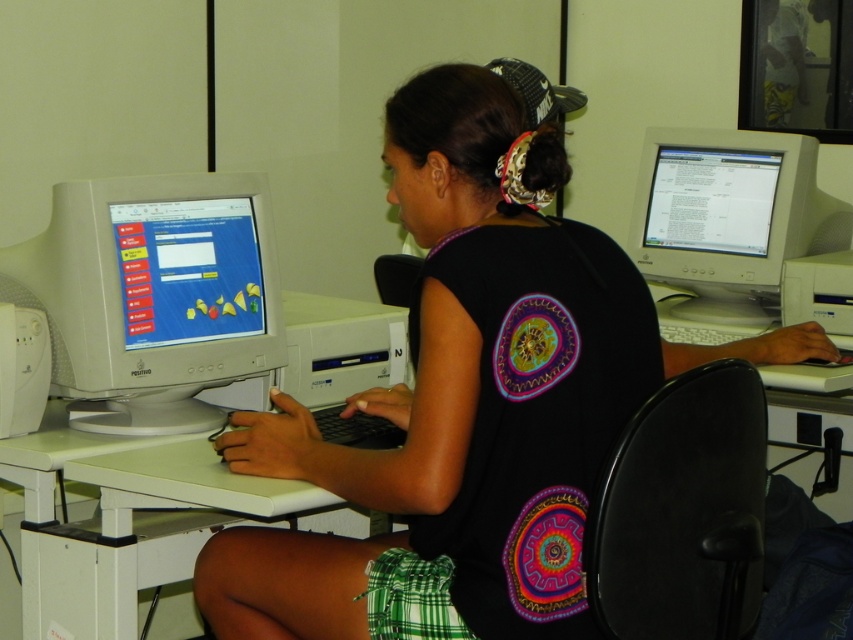
Find the location of a particular element. This screenshot has width=853, height=640. black plastic chair at center is located at coordinates click(x=682, y=512).

I want to click on black plastic chair at center, so click(682, 512).

You are a GUI agent. You are given a task and a screenshot of the screen. Output one action in this format:
    pyautogui.click(x=<x>, y=<y>)
    Task: Click on the black plastic chair at center
    The width and height of the screenshot is (853, 640).
    Given the screenshot: What is the action you would take?
    pyautogui.click(x=682, y=512)

Can you confirm if matte black shirt at center is positioned above black plastic chair at center?

Indeed, matte black shirt at center is positioned over black plastic chair at center.

Does matte black shirt at center have a greater height compared to black plastic chair at center?

Indeed, matte black shirt at center has a greater height compared to black plastic chair at center.

Which is in front, point (405, 435) or point (631, 480)?

Point (631, 480) is more forward.

Find the location of a particular element. matte black shirt at center is located at coordinates (457, 403).

Does white plastic computer desk at center have a lesser width compared to white plastic monitor at right?

No, white plastic computer desk at center is not thinner than white plastic monitor at right.

Can you confirm if white plastic computer desk at center is positioned to the left of white plastic monitor at right?

Indeed, white plastic computer desk at center is positioned on the left side of white plastic monitor at right.

The image size is (853, 640). Find the location of `white plastic computer desk at center`. white plastic computer desk at center is located at coordinates (126, 518).